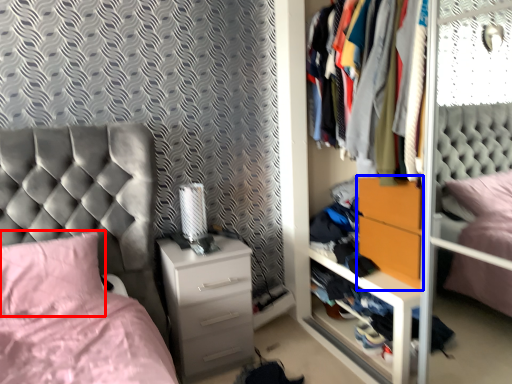
Question: Which object appears closest to the camera in this image, pillow (highlighted by a red box) or nightstand (highlighted by a blue box)?

Choices:
 (A) pillow
 (B) nightstand

Answer: (A)